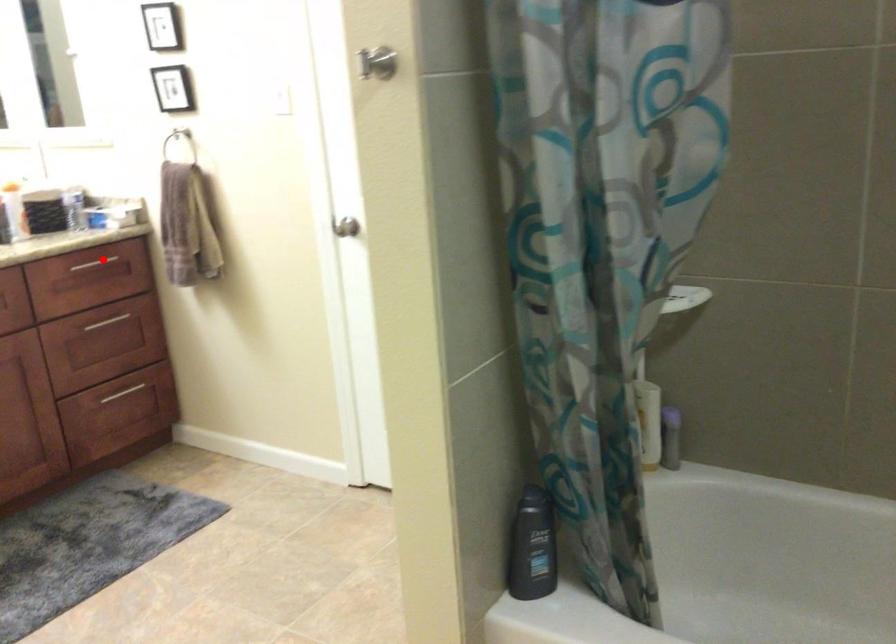
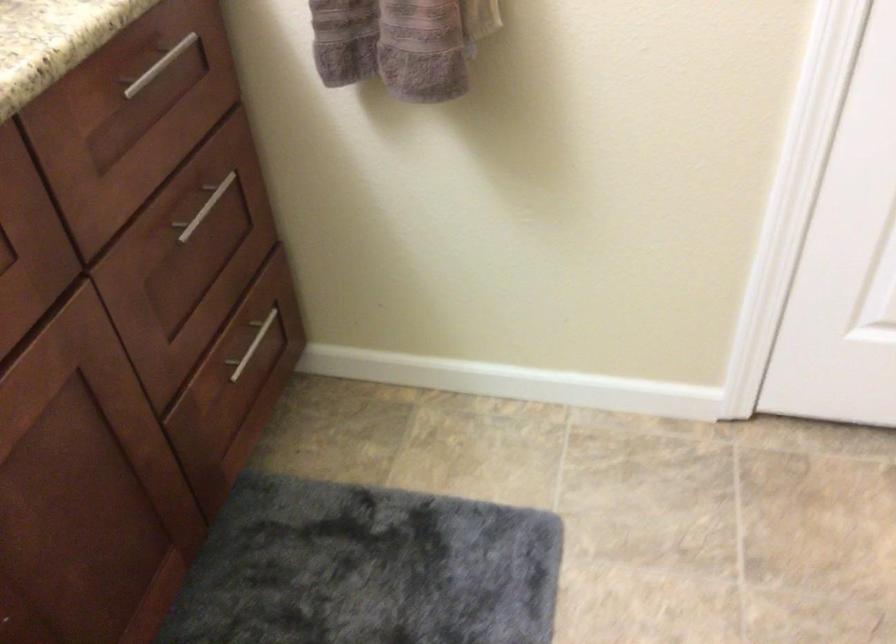
Question: I am providing you with two images of the same scene from different viewpoints. Given a red point in image1, look at the same physical point in image2. Is it:

Choices:
 (A) Closer to the viewpoint
 (B) Farther from the viewpoint

Answer: (A)